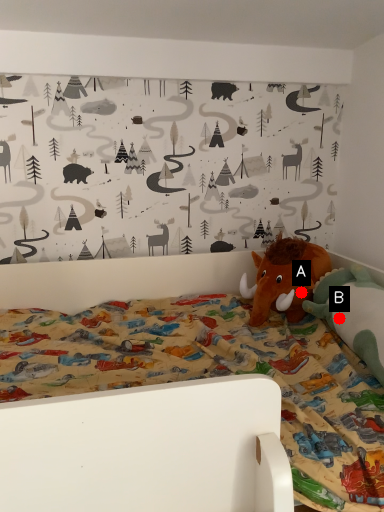
Question: Two points are circled on the image, labeled by A and B beside each circle. Which point is closer to the camera?

Choices:
 (A) A is closer
 (B) B is closer

Answer: (B)